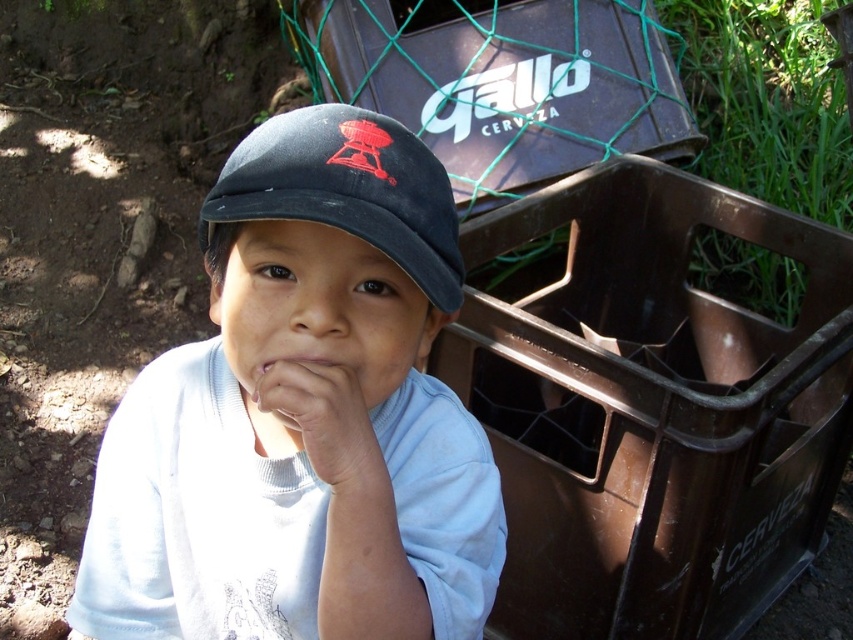
Does point (440, 289) come farther from viewer compared to point (300, 385)?

Yes.

Can you confirm if black fabric cap at center is thinner than white matte hand at center?

In fact, black fabric cap at center might be wider than white matte hand at center.

You are a GUI agent. You are given a task and a screenshot of the screen. Output one action in this format:
    pyautogui.click(x=<x>, y=<y>)
    Task: Click on the black fabric cap at center
    
    Given the screenshot: What is the action you would take?
    pyautogui.click(x=346, y=189)

Looking at this image, does matte blue cap at center have a larger size compared to white matte hand at center?

Correct, matte blue cap at center is larger in size than white matte hand at center.

Where is `matte blue cap at center`? matte blue cap at center is located at coordinates click(x=302, y=416).

Is point (171, 500) closer to viewer compared to point (358, 412)?

No, it is behind (358, 412).

Image resolution: width=853 pixels, height=640 pixels. Identify the location of matte blue cap at center. (302, 416).

Can you confirm if matte blue cap at center is positioned to the left of black fabric cap at center?

Indeed, matte blue cap at center is positioned on the left side of black fabric cap at center.

Is point (239, 529) less distant than point (415, 156)?

No, (239, 529) is further to viewer.

Where is `matte blue cap at center`? matte blue cap at center is located at coordinates (302, 416).